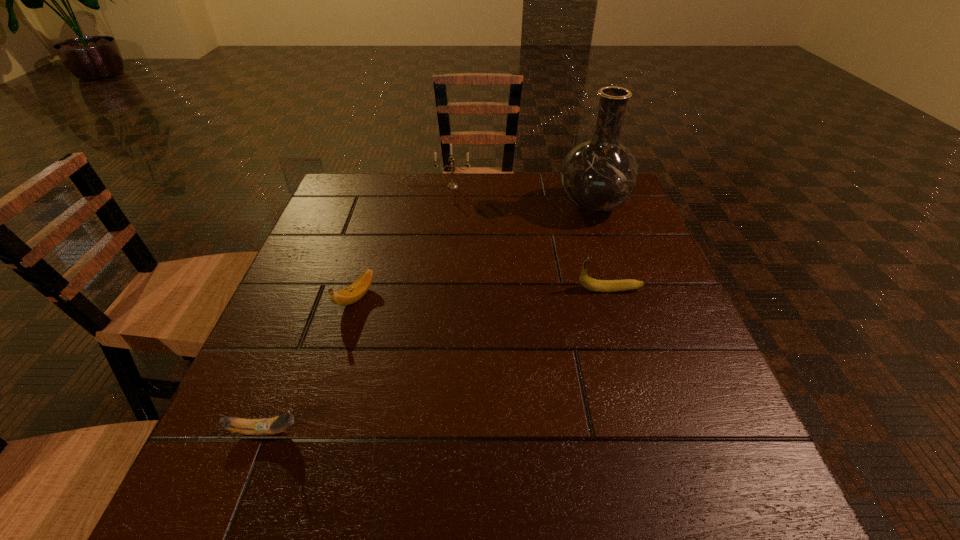
In order to click on vase in this screenshot , I will do `click(599, 175)`.

Image resolution: width=960 pixels, height=540 pixels. Identify the location of the third object from left to right. (452, 185).

Where is `candle`? The height and width of the screenshot is (540, 960). candle is located at coordinates (452, 185).

Locate an element on the screen. the rightmost banana is located at coordinates (587, 282).

Identify the location of the tallest banana. (587, 282).

The width and height of the screenshot is (960, 540). I want to click on the nearest object, so click(266, 426).

In order to click on free space located on the left of the vase in this screenshot , I will do `click(433, 207)`.

Find the location of a particular element. vacant space located 0.390m on the front of the second tallest object is located at coordinates [x=444, y=280].

In order to click on vacant area located at the stem of the rightmost banana in this screenshot , I will do `click(395, 289)`.

Where is `free space located 0.140m at the stem of the rightmost banana`? free space located 0.140m at the stem of the rightmost banana is located at coordinates pos(514,289).